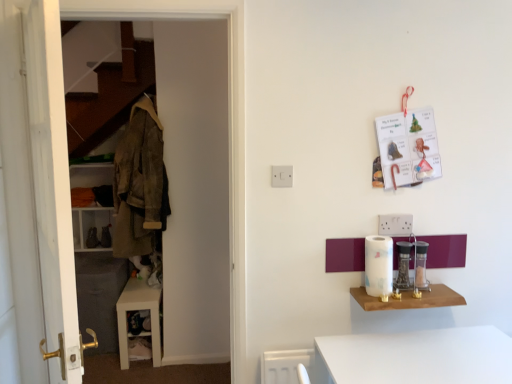
Question: From the image's perspective, is wooden shelf at lower right positioned above or below clear glass jar at right, the first appliance from the right?

Choices:
 (A) below
 (B) above

Answer: (A)

Question: Is wooden shelf at lower right spatially inside clear glass jar at right, which is the 3th appliance from left to right, or outside of it?

Choices:
 (A) inside
 (B) outside

Answer: (B)

Question: Based on their relative distances, which object is farther from the white glossy paper towel holder at right, which appears as the second appliance when viewed from the right?

Choices:
 (A) white wooden door at left
 (B) white plastic electric outlet at center
 (C) white wooden dresser at left
 (D) white paper towel at right, which appears as the 1th appliance when viewed from the left
 (E) brown corduroy jacket at left

Answer: (E)

Question: Based on their relative distances, which object is farther from the brown suede shoe at left?

Choices:
 (A) white plastic electric outlet at center
 (B) white paper towel at right, which appears as the 3th appliance when viewed from the right
 (C) white wooden dresser at left
 (D) clear glass jar at right, the first appliance from the right
 (E) white glossy cabinet at lower left

Answer: (D)